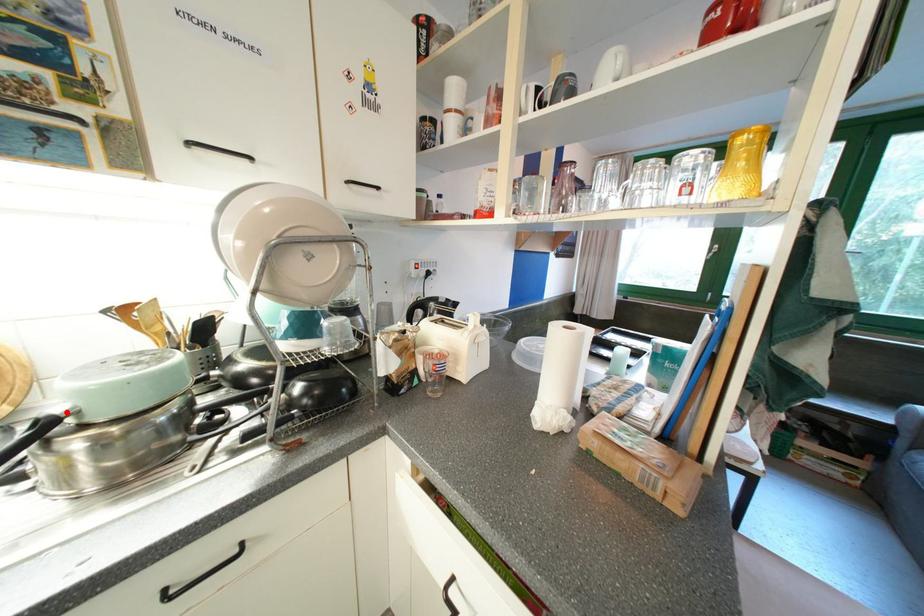
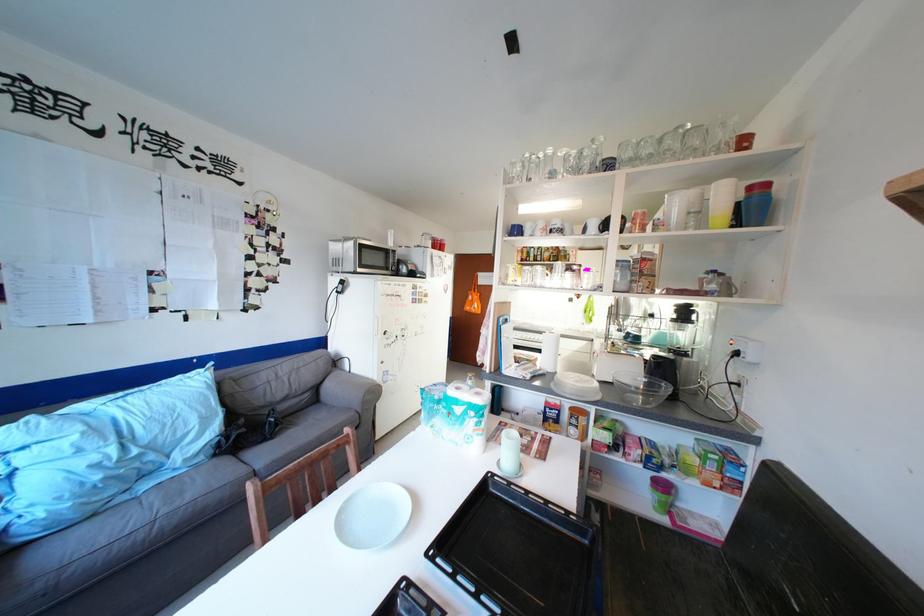
Question: I am providing you with two images of the same scene from different viewpoints. A red point is marked on the first image. Can you still see the location of the red point in image 2?

Choices:
 (A) Yes
 (B) No

Answer: (B)